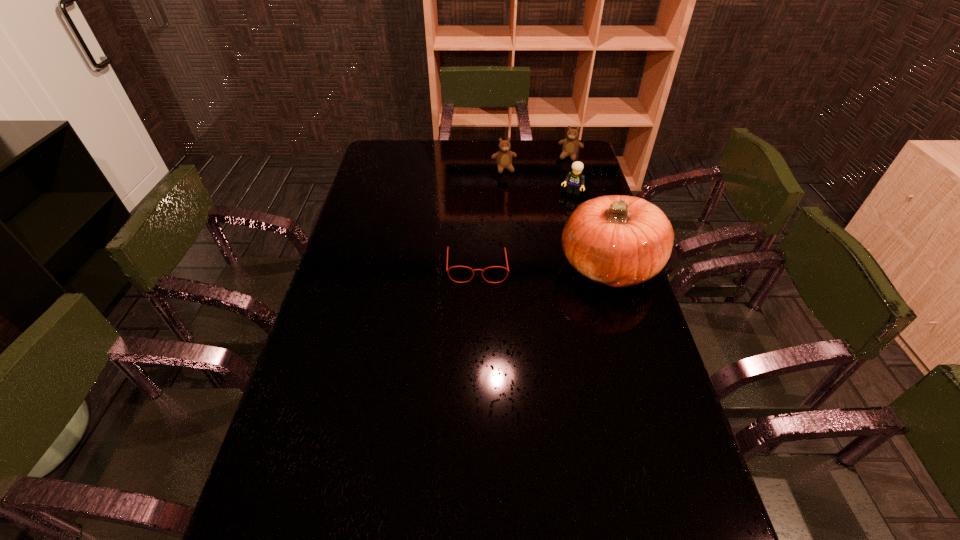
Where is `free space that is in between the pumpkin and the spectacles`? This screenshot has height=540, width=960. free space that is in between the pumpkin and the spectacles is located at coordinates [543, 266].

Identify the location of free spot between the right teddy bear and the nearer teddy bear. Image resolution: width=960 pixels, height=540 pixels. (537, 163).

Locate an element on the screen. This screenshot has width=960, height=540. free space between the shortest object and the farther teddy bear is located at coordinates (524, 212).

Locate an element on the screen. free space that is in between the pumpkin and the spectacles is located at coordinates (543, 266).

Select which object is the closest to the third farthest object. Please provide its 2D coordinates. Your answer should be formatted as a tuple, i.e. [(x, y)], where the tuple contains the x and y coordinates of a point satisfying the conditions above.

[(570, 147)]

Locate an element on the screen. The height and width of the screenshot is (540, 960). object that is the third closest to the tallest object is located at coordinates (503, 157).

This screenshot has height=540, width=960. I want to click on free point that satisfies the following two spatial constraints: 1. on the back side of the third nearest object; 2. on the right side of the right teddy bear, so click(567, 157).

The image size is (960, 540). What are the coordinates of `free location that satisfies the following two spatial constraints: 1. on the front side of the tallest object; 2. on the left side of the third nearest object` in the screenshot? It's located at (596, 265).